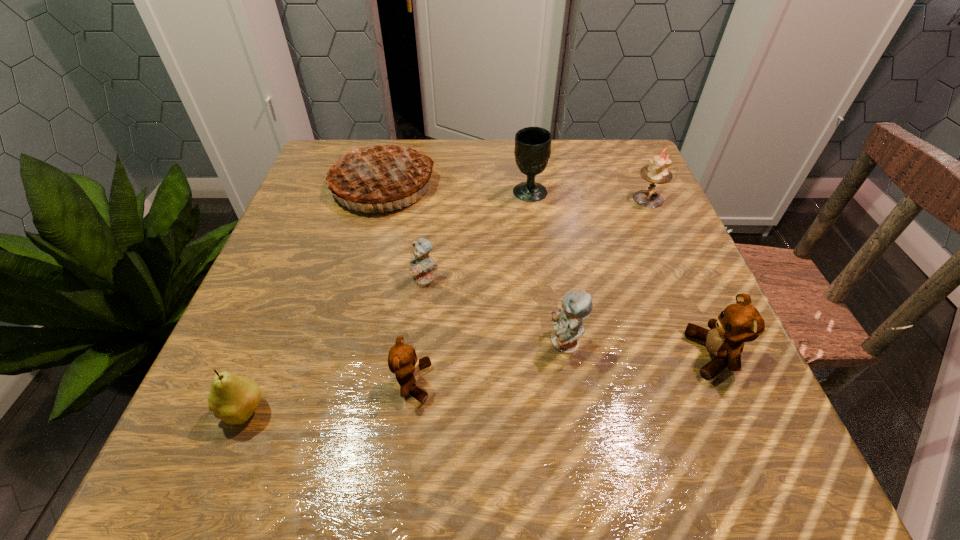
I want to click on teddy bear that is at the right edge, so click(x=741, y=322).

Where is `object that is at the far left corner`? object that is at the far left corner is located at coordinates (376, 172).

The width and height of the screenshot is (960, 540). In order to click on object at the near left corner in this screenshot , I will do `click(233, 399)`.

Where is `object present at the far right corner`? This screenshot has width=960, height=540. object present at the far right corner is located at coordinates (657, 172).

Find the location of a particular element. The image size is (960, 540). vacant space at the far edge is located at coordinates tap(567, 163).

The image size is (960, 540). I want to click on vacant area at the left edge of the desktop, so click(x=286, y=348).

Image resolution: width=960 pixels, height=540 pixels. I want to click on free space at the right edge of the desktop, so [681, 238].

Where is `vacant space at the far left corner of the desktop`? vacant space at the far left corner of the desktop is located at coordinates (328, 141).

The height and width of the screenshot is (540, 960). I want to click on vacant region at the near left corner of the desktop, so click(x=214, y=440).

At what (x,y) coordinates should I click in order to perform the action: click on free space at the far right corner. Please return your answer as a coordinate pair (x, y). Looking at the image, I should click on (625, 189).